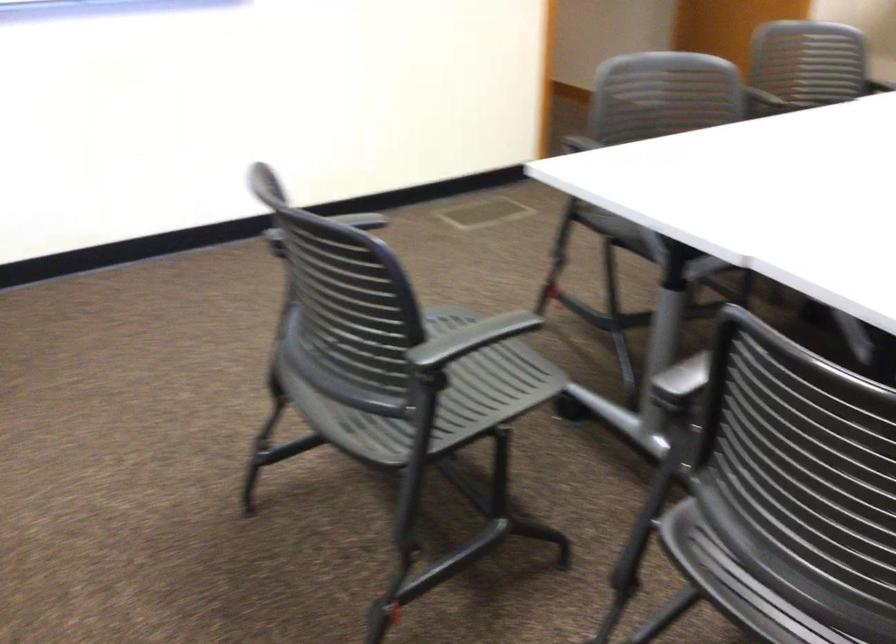
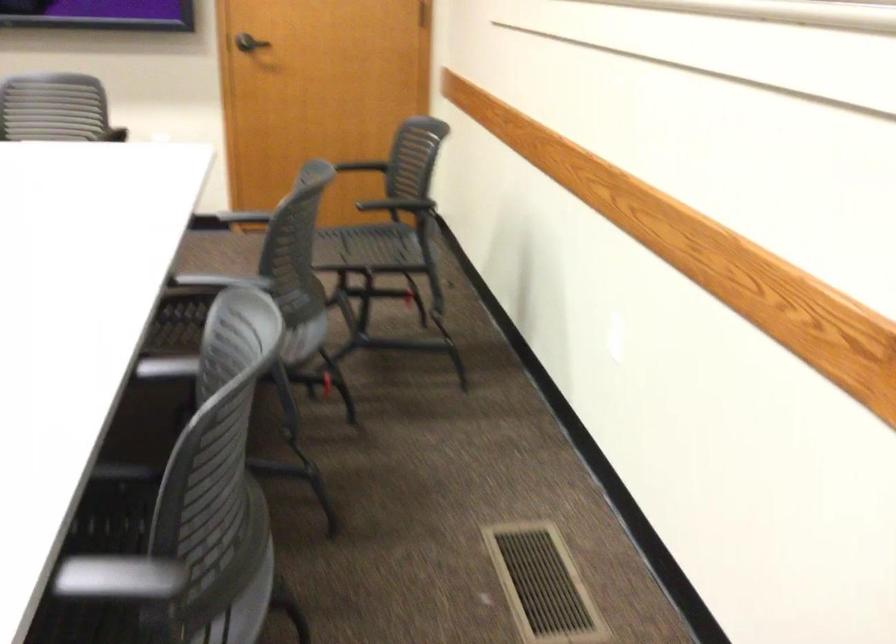
Question: How did the camera likely rotate?

Choices:
 (A) Left
 (B) Right
 (C) Up
 (D) Down

Answer: (B)